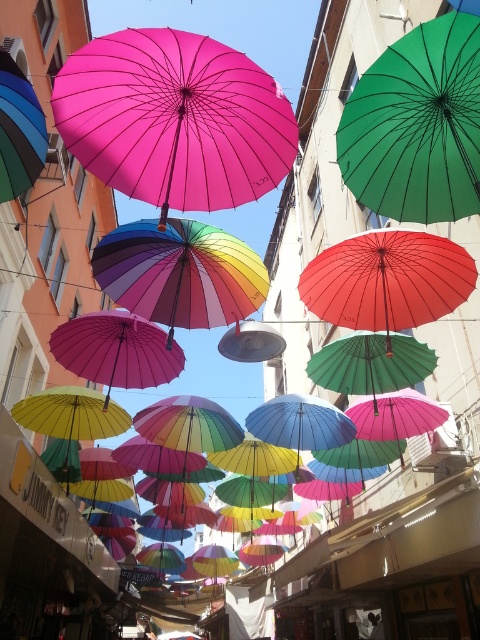
You are a painter standing on the street looking up at the umbrellas. You want to paint the green matte umbrella at upper right and the red matte umbrella at center. Which umbrella is closer to the left side of your view?

The green matte umbrella at upper right is positioned on the left side of the red matte umbrella at center, so it appears closer to the left side of your view.

You are standing on the street looking up at the umbrellas. Which of the two umbrellas, the pink matte umbrella at upper center or the green matte umbrella at upper right, is positioned to the left of the other?

The pink matte umbrella at upper center is positioned to the left of the green matte umbrella at upper right.